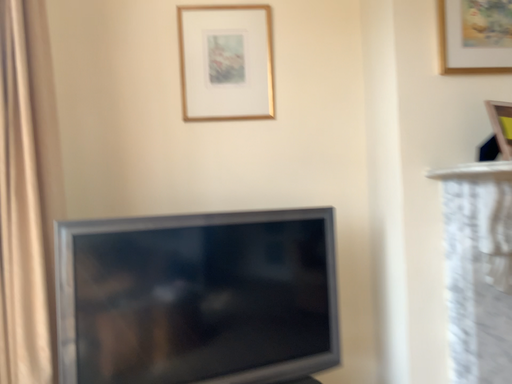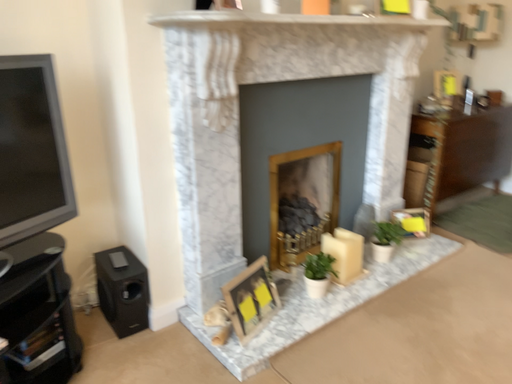
Question: Which way did the camera rotate in the video?

Choices:
 (A) rotated downward
 (B) rotated upward

Answer: (A)